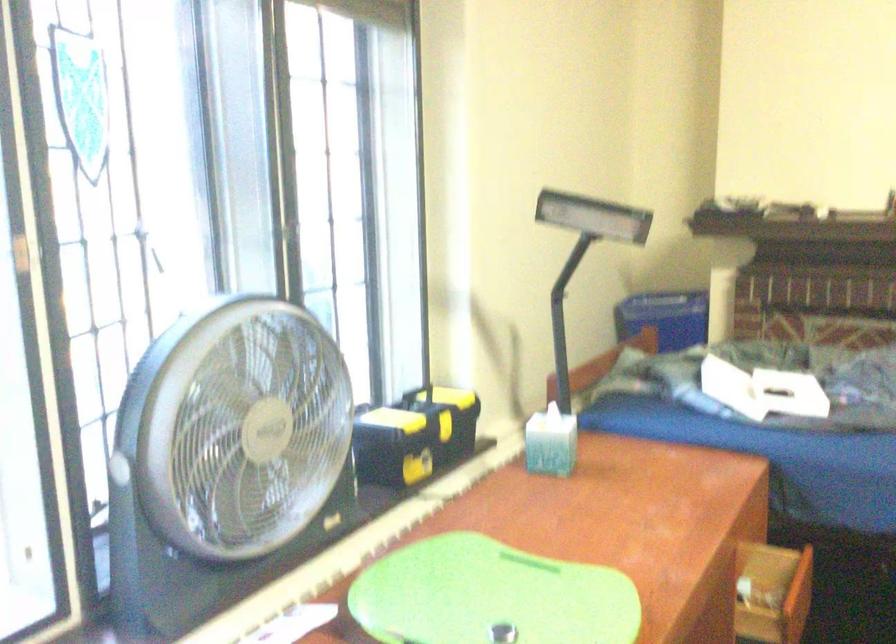
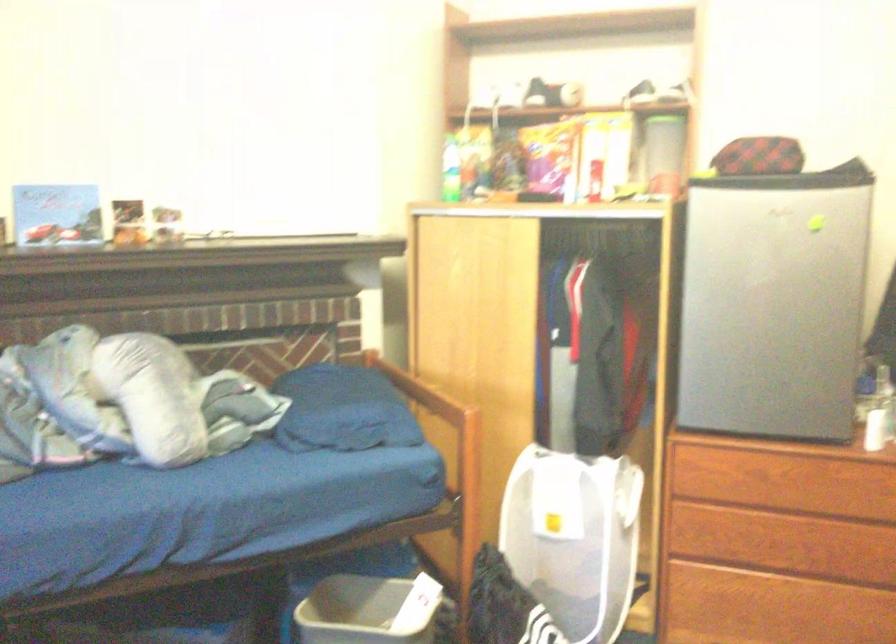
Question: The images are taken continuously from a first-person perspective. In which direction is your viewpoint rotating?

Choices:
 (A) Left
 (B) Right
 (C) Up
 (D) Down

Answer: (B)